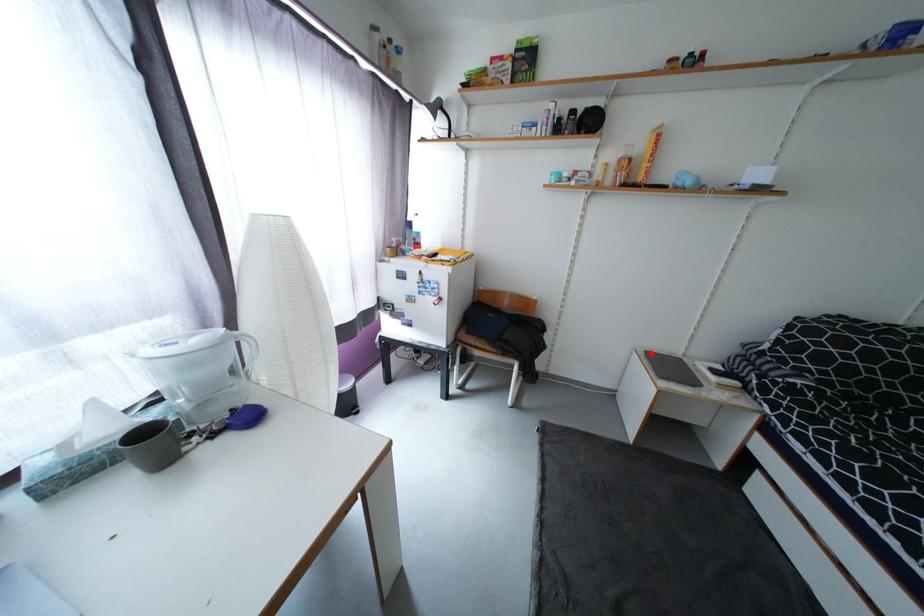
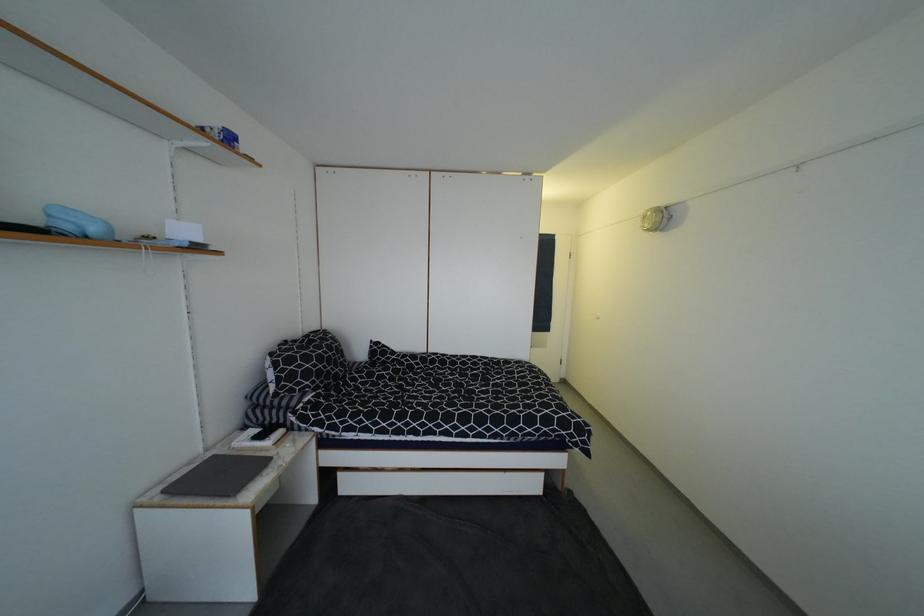
The point at the highlighted location is marked in the first image. Where is the corresponding point in the second image?

(169, 493)